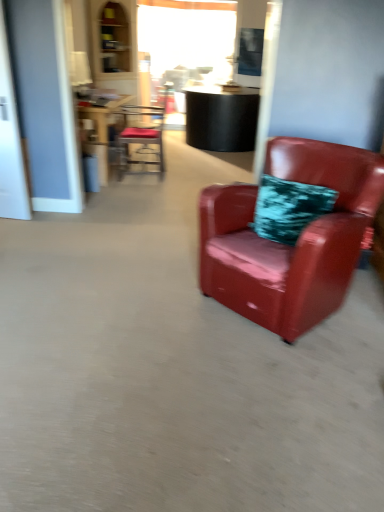
Identify the location of free space to the left of glossy leather armchair at right, which is counted as the 1th chair, starting from the bottom. The width and height of the screenshot is (384, 512). (150, 303).